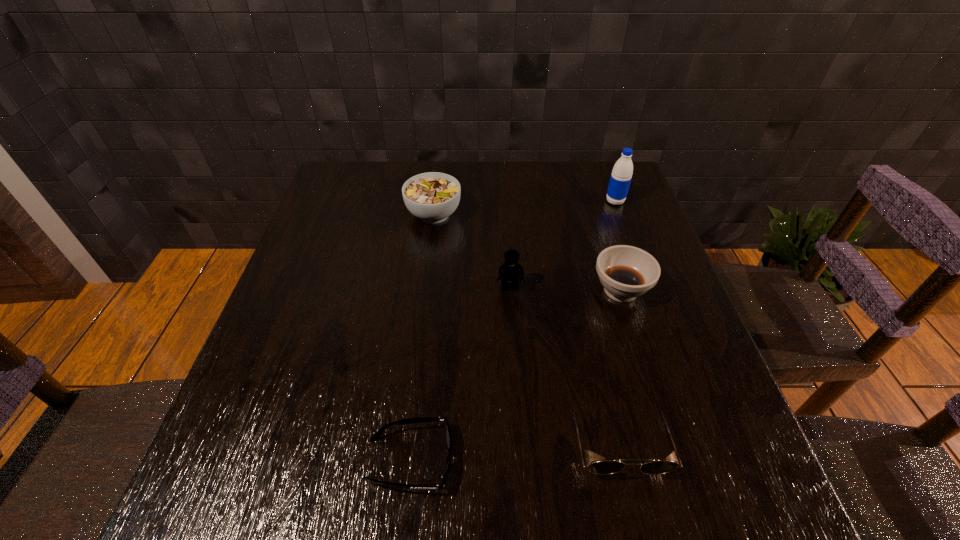
Image resolution: width=960 pixels, height=540 pixels. Identify the location of free space between the right sunglasses and the right soup bowl. (618, 366).

At what (x,y) coordinates should I click in order to perform the action: click on blank region between the left soup bowl and the Lego. Please return your answer as a coordinate pair (x, y). The height and width of the screenshot is (540, 960). Looking at the image, I should click on (471, 251).

Where is `vacant space in between the fourth object from right to left and the taller sunglasses`? The image size is (960, 540). vacant space in between the fourth object from right to left and the taller sunglasses is located at coordinates (564, 364).

The width and height of the screenshot is (960, 540). I want to click on vacant area between the tallest object and the third object from left to right, so click(563, 245).

Where is `free space between the tallest object and the taller sunglasses`? free space between the tallest object and the taller sunglasses is located at coordinates (616, 321).

Locate which object ranks third in proximity to the left soup bowl. Please provide its 2D coordinates. Your answer should be formatted as a tuple, i.e. [(x, y)], where the tuple contains the x and y coordinates of a point satisfying the conditions above.

[(621, 175)]

Locate an element on the screen. This screenshot has width=960, height=540. object that is the fourth closest to the taller sunglasses is located at coordinates (432, 197).

This screenshot has height=540, width=960. I want to click on vacant point that satisfies the following two spatial constraints: 1. on the front side of the water bottle; 2. on the front-facing side of the shortest object, so click(710, 460).

Where is `free location that satisfies the following two spatial constraints: 1. on the front lenses of the right sunglasses; 2. on the front-facing side of the left sunglasses`? free location that satisfies the following two spatial constraints: 1. on the front lenses of the right sunglasses; 2. on the front-facing side of the left sunglasses is located at coordinates (621, 460).

Image resolution: width=960 pixels, height=540 pixels. What are the coordinates of `free space that satisfies the following two spatial constraints: 1. on the front-facing side of the right soup bowl; 2. on the left side of the Lego` in the screenshot? It's located at (510, 291).